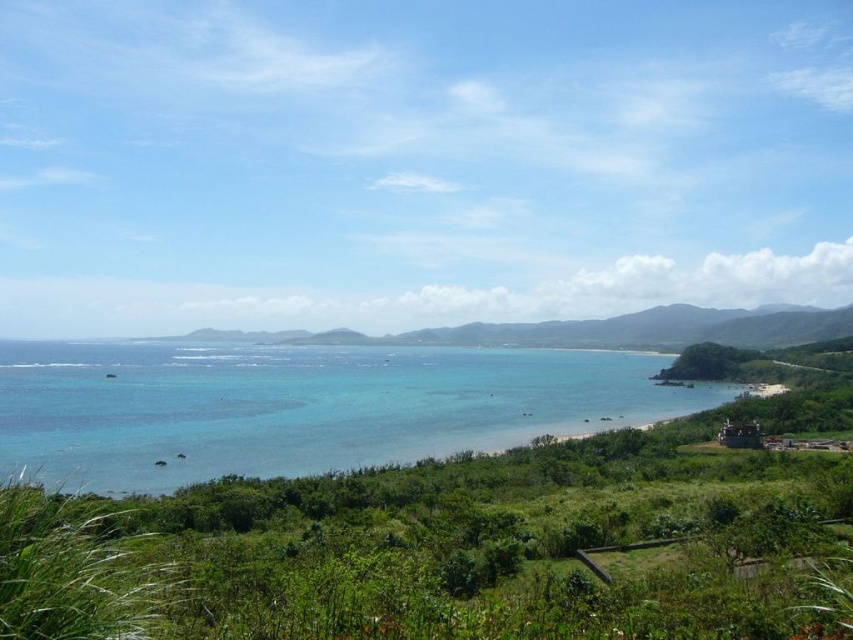
Does green leafy vegetation at center appear under green grassy hillside at center?

Yes, green leafy vegetation at center is below green grassy hillside at center.

Is green leafy vegetation at center to the left of green grassy hillside at center from the viewer's perspective?

Correct, you'll find green leafy vegetation at center to the left of green grassy hillside at center.

Image resolution: width=853 pixels, height=640 pixels. I want to click on green leafy vegetation at center, so click(x=438, y=548).

Does clear blue water at center have a lesser height compared to green grassy hillside at center?

Yes, clear blue water at center is shorter than green grassy hillside at center.

Is clear blue water at center taller than green grassy hillside at center?

Incorrect, clear blue water at center's height is not larger of green grassy hillside at center's.

The width and height of the screenshot is (853, 640). What are the coordinates of `clear blue water at center` in the screenshot? It's located at (303, 406).

Based on the photo, who is more forward, (368, 618) or (474, 380)?

Point (368, 618)

Does green leafy vegetation at center have a smaller size compared to clear blue water at center?

Yes.

Find the location of a particular element. green leafy vegetation at center is located at coordinates (438, 548).